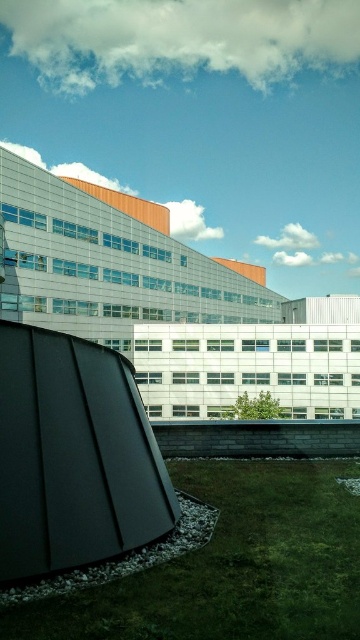
Question: Is green grass at lower center bigger than matte black sculpture at lower left?

Choices:
 (A) yes
 (B) no

Answer: (B)

Question: Which of the following is the farthest from the observer?

Choices:
 (A) green grass at lower center
 (B) matte black sculpture at lower left

Answer: (B)

Question: Does green grass at lower center appear on the left side of matte black sculpture at lower left?

Choices:
 (A) no
 (B) yes

Answer: (A)

Question: Which point is closer to the camera?

Choices:
 (A) green grass at lower center
 (B) matte black sculpture at lower left

Answer: (A)

Question: Does green grass at lower center have a lesser width compared to matte black sculpture at lower left?

Choices:
 (A) yes
 (B) no

Answer: (B)

Question: Which point is farther from the camera taking this photo?

Choices:
 (A) (168, 508)
 (B) (147, 625)

Answer: (A)